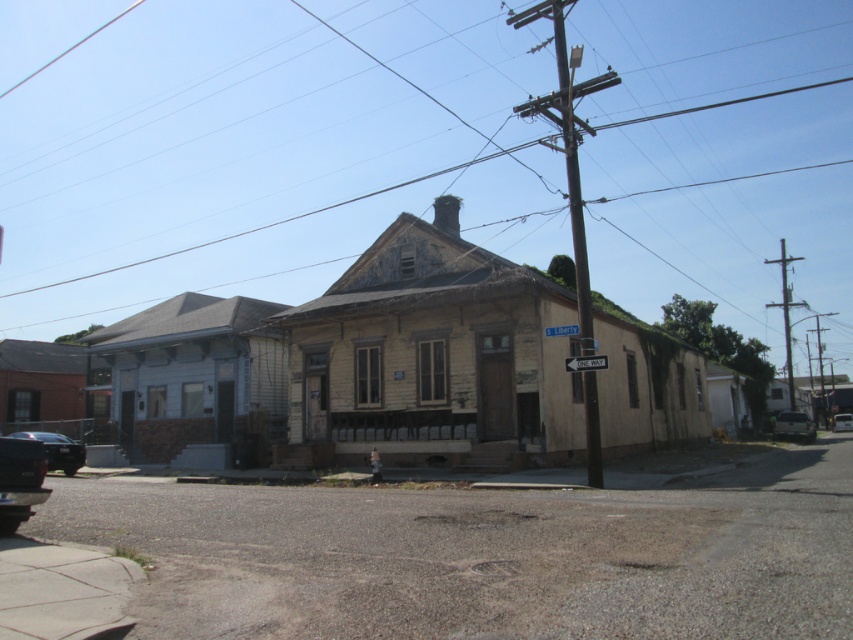
Is point (577, 296) positioned after point (36, 499)?

Yes, point (577, 296) is farther from viewer.

Between wooden utility pole at center and shiny black car at lower left, which one has more height?

With more height is wooden utility pole at center.

I want to click on wooden utility pole at center, so 567,141.

Is shiny black car at lower left thinner than shiny black sedan at lower left?

Yes.

Is shiny black car at lower left positioned in front of shiny black sedan at lower left?

Yes, shiny black car at lower left is in front of shiny black sedan at lower left.

The height and width of the screenshot is (640, 853). I want to click on shiny black car at lower left, so click(x=19, y=481).

Is point (33, 458) closer to viewer compared to point (785, 333)?

Yes.

Can you confirm if shiny black car at lower left is bigger than metallic gray utility pole at right?

Incorrect, shiny black car at lower left is not larger than metallic gray utility pole at right.

Is point (28, 444) positioned after point (782, 289)?

No, (28, 444) is closer to viewer.

Locate an element on the screen. The height and width of the screenshot is (640, 853). shiny black car at lower left is located at coordinates (19, 481).